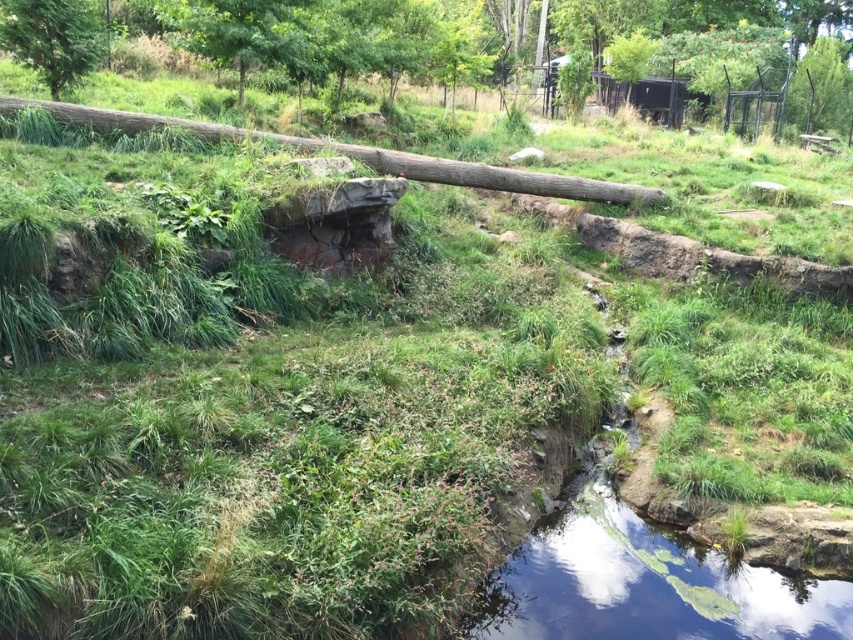
Measure the distance between point (41,100) and camera.

They are 4.95 meters apart.

Is brown rough log at center below green matte tree at upper left?

Correct, brown rough log at center is located below green matte tree at upper left.

At what (x,y) coordinates should I click in order to perform the action: click on brown rough log at center. Please return your answer as a coordinate pair (x, y). Looking at the image, I should click on (363, 156).

Does green leafy tree at upper center have a smaller size compared to green matte tree at upper left?

Incorrect, green leafy tree at upper center is not smaller in size than green matte tree at upper left.

Measure the distance between point (796, 17) and camera.

They are 15.04 meters apart.

At what (x,y) coordinates should I click in order to perform the action: click on green leafy tree at upper center. Please return your answer as a coordinate pair (x, y). This screenshot has height=640, width=853. Looking at the image, I should click on (289, 35).

Between point (347, 22) and point (547, 173), which one is positioned in front?

Point (547, 173) is in front.

Does green leafy tree at upper center come behind brown rough log at center?

Yes, green leafy tree at upper center is behind brown rough log at center.

Locate an element on the screen. green leafy tree at upper center is located at coordinates (289, 35).